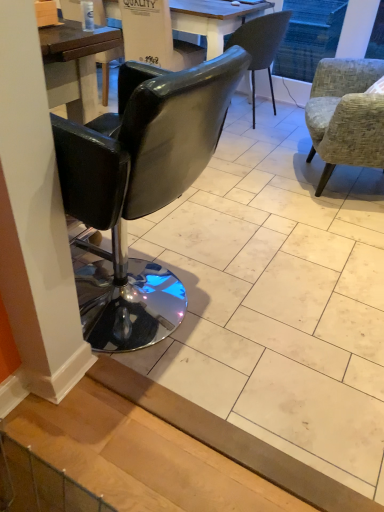
Where is `free point behind black leather chair at left, acting as the first chair starting from the left`? The width and height of the screenshot is (384, 512). free point behind black leather chair at left, acting as the first chair starting from the left is located at coordinates (197, 237).